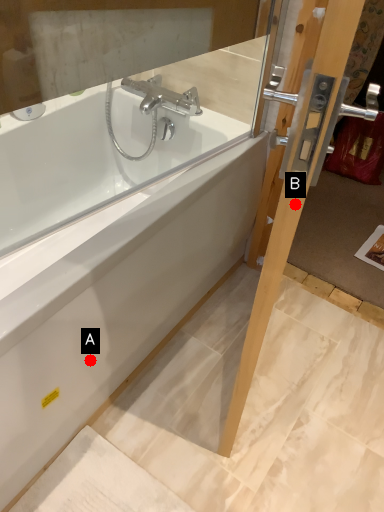
Question: Two points are circled on the image, labeled by A and B beside each circle. Which point is closer to the camera?

Choices:
 (A) A is closer
 (B) B is closer

Answer: (B)